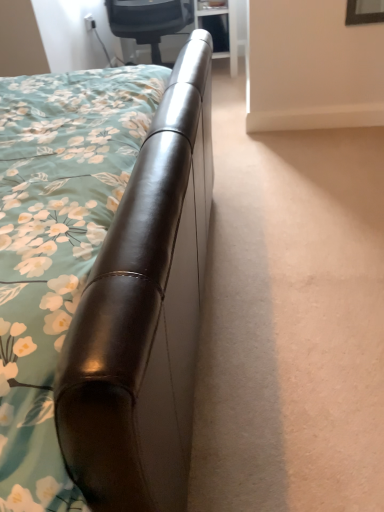
Question: Is brown leather bed at upper left further to camera compared to matte black chair at upper center?

Choices:
 (A) no
 (B) yes

Answer: (A)

Question: Is brown leather bed at upper left at the left side of matte black chair at upper center?

Choices:
 (A) yes
 (B) no

Answer: (A)

Question: Does brown leather bed at upper left have a lesser width compared to matte black chair at upper center?

Choices:
 (A) yes
 (B) no

Answer: (B)

Question: From a real-world perspective, is brown leather bed at upper left under matte black chair at upper center?

Choices:
 (A) yes
 (B) no

Answer: (B)

Question: Does brown leather bed at upper left have a smaller size compared to matte black chair at upper center?

Choices:
 (A) no
 (B) yes

Answer: (A)

Question: From the image's perspective, is brown leather bed at upper left over matte black chair at upper center?

Choices:
 (A) no
 (B) yes

Answer: (A)

Question: Is matte black chair at upper center to the right of brown leather bed at upper left from the viewer's perspective?

Choices:
 (A) no
 (B) yes

Answer: (B)

Question: Is brown leather bed at upper left at the back of matte black chair at upper center?

Choices:
 (A) yes
 (B) no

Answer: (A)

Question: Is matte black chair at upper center next to brown leather bed at upper left and touching it?

Choices:
 (A) yes
 (B) no

Answer: (B)

Question: Can you confirm if matte black chair at upper center is smaller than brown leather bed at upper left?

Choices:
 (A) yes
 (B) no

Answer: (A)

Question: Does matte black chair at upper center contain brown leather bed at upper left?

Choices:
 (A) yes
 (B) no

Answer: (B)

Question: Would you consider matte black chair at upper center to be distant from brown leather bed at upper left?

Choices:
 (A) no
 (B) yes

Answer: (B)

Question: Is point (125, 502) closer or farther from the camera than point (185, 15)?

Choices:
 (A) farther
 (B) closer

Answer: (B)